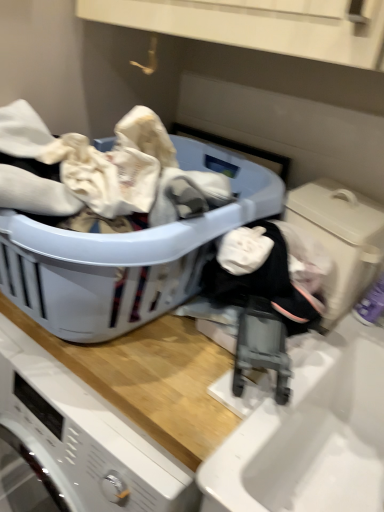
The image size is (384, 512). What are the coordinates of `beige plastic washing machine at lower right` in the screenshot? It's located at (340, 239).

Describe the element at coordinates (340, 239) in the screenshot. The height and width of the screenshot is (512, 384). I see `beige plastic washing machine at lower right` at that location.

What is the approximate height of beige plastic washing machine at lower right?

beige plastic washing machine at lower right is 9.94 inches tall.

What do you see at coordinates (126, 256) in the screenshot? I see `plastic laundry basket at center` at bounding box center [126, 256].

In order to click on plastic laundry basket at center in this screenshot , I will do `click(126, 256)`.

Locate an element on the screen. This screenshot has width=384, height=512. beige plastic washing machine at lower right is located at coordinates (340, 239).

Considering the positions of objects plastic laundry basket at center and beige plastic washing machine at lower right in the image provided, who is more to the right, plastic laundry basket at center or beige plastic washing machine at lower right?

beige plastic washing machine at lower right.

Which is behind, plastic laundry basket at center or beige plastic washing machine at lower right?

beige plastic washing machine at lower right is further from the camera.

Is point (236, 209) closer or farther from the camera than point (349, 294)?

Point (236, 209) is closer to the camera than point (349, 294).

From the image's perspective, is plastic laundry basket at center above beige plastic washing machine at lower right?

Correct, plastic laundry basket at center appears higher than beige plastic washing machine at lower right in the image.

From a real-world perspective, relative to beige plastic washing machine at lower right, is plastic laundry basket at center vertically above or below?

plastic laundry basket at center is situated lower than beige plastic washing machine at lower right in the real world.

Considering the relative sizes of plastic laundry basket at center and beige plastic washing machine at lower right in the image provided, is plastic laundry basket at center wider than beige plastic washing machine at lower right?

Yes.

From the picture: Is plastic laundry basket at center shorter than beige plastic washing machine at lower right?

In fact, plastic laundry basket at center may be taller than beige plastic washing machine at lower right.

Is plastic laundry basket at center bigger than beige plastic washing machine at lower right?

Yes, plastic laundry basket at center is bigger than beige plastic washing machine at lower right.

Would you say beige plastic washing machine at lower right is part of plastic laundry basket at center's contents?

No, beige plastic washing machine at lower right is located outside of plastic laundry basket at center.

Is plastic laundry basket at center next to beige plastic washing machine at lower right?

No, plastic laundry basket at center is not beside beige plastic washing machine at lower right.

From the picture: Is plastic laundry basket at center facing towards beige plastic washing machine at lower right?

No, plastic laundry basket at center is not aimed at beige plastic washing machine at lower right.

How many degrees apart are the facing directions of plastic laundry basket at center and beige plastic washing machine at lower right?

1.02 degrees separate the facing orientations of plastic laundry basket at center and beige plastic washing machine at lower right.

Locate an element on the screen. The image size is (384, 512). washing machine lying below the plastic laundry basket at center (from the image's perspective) is located at coordinates (340, 239).

Between beige plastic washing machine at lower right and plastic laundry basket at center, which one appears on the right side from the viewer's perspective?

beige plastic washing machine at lower right.

Looking at this image, does beige plastic washing machine at lower right come behind plastic laundry basket at center?

Yes, beige plastic washing machine at lower right is further from the viewer.

Between point (323, 205) and point (202, 168), which one is positioned behind?

The point (202, 168) is behind.

From the image's perspective, is beige plastic washing machine at lower right on plastic laundry basket at center?

No.

From a real-world perspective, who is located lower, beige plastic washing machine at lower right or plastic laundry basket at center?

In real-world perspective, plastic laundry basket at center is lower.

Which of these two, beige plastic washing machine at lower right or plastic laundry basket at center, is thinner?

Thinner between the two is beige plastic washing machine at lower right.

Between beige plastic washing machine at lower right and plastic laundry basket at center, which one has less height?

beige plastic washing machine at lower right is shorter.

Looking at the image, does beige plastic washing machine at lower right seem bigger or smaller compared to plastic laundry basket at center?

Considering their sizes, beige plastic washing machine at lower right takes up less space than plastic laundry basket at center.

Would you say plastic laundry basket at center is part of beige plastic washing machine at lower right's contents?

No, plastic laundry basket at center is not inside beige plastic washing machine at lower right.

Is beige plastic washing machine at lower right not near plastic laundry basket at center?

That's not correct — beige plastic washing machine at lower right is a little close to plastic laundry basket at center.

In the scene shown: Is beige plastic washing machine at lower right oriented away from plastic laundry basket at center?

beige plastic washing machine at lower right is not turned away from plastic laundry basket at center.

Could you measure the distance between beige plastic washing machine at lower right and plastic laundry basket at center?

beige plastic washing machine at lower right and plastic laundry basket at center are 27.35 centimeters apart.

This screenshot has width=384, height=512. I want to click on laundry basket that is under the beige plastic washing machine at lower right (from a real-world perspective), so click(126, 256).

Find the location of `washing machine located below the plastic laundry basket at center (from the image's perspective)`. washing machine located below the plastic laundry basket at center (from the image's perspective) is located at coordinates (340, 239).

Where is `laundry basket below the beige plastic washing machine at lower right (from a real-world perspective)`? laundry basket below the beige plastic washing machine at lower right (from a real-world perspective) is located at coordinates (126, 256).